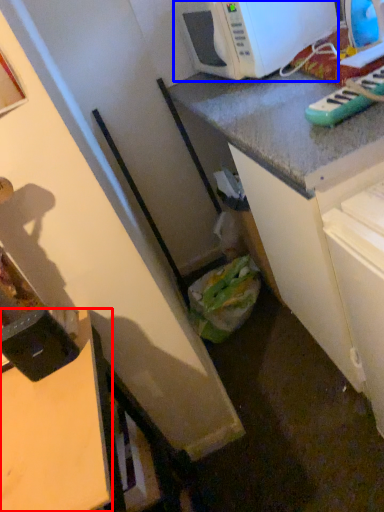
Question: Which point is closer to the camera, desk (highlighted by a red box) or microwave oven (highlighted by a blue box)?

Choices:
 (A) desk
 (B) microwave oven

Answer: (A)